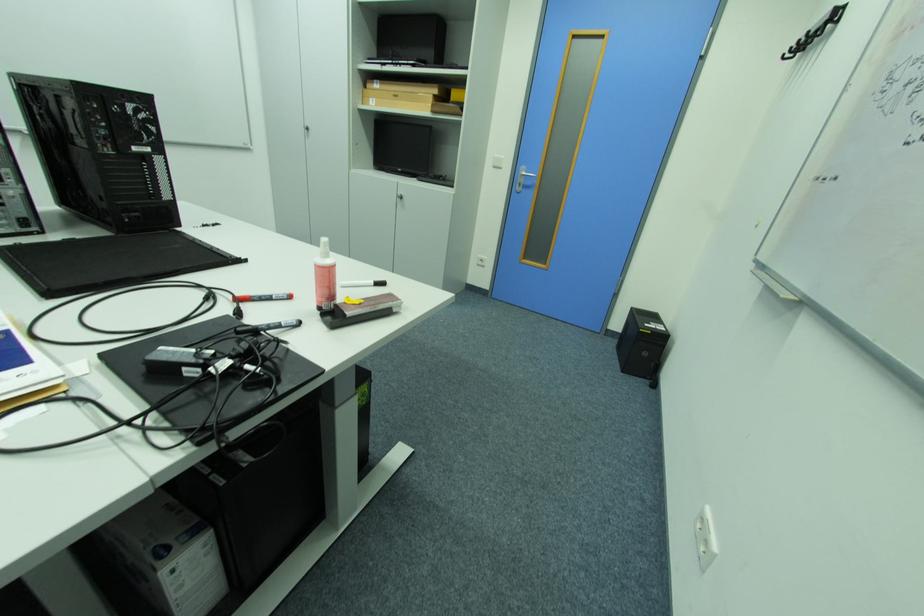
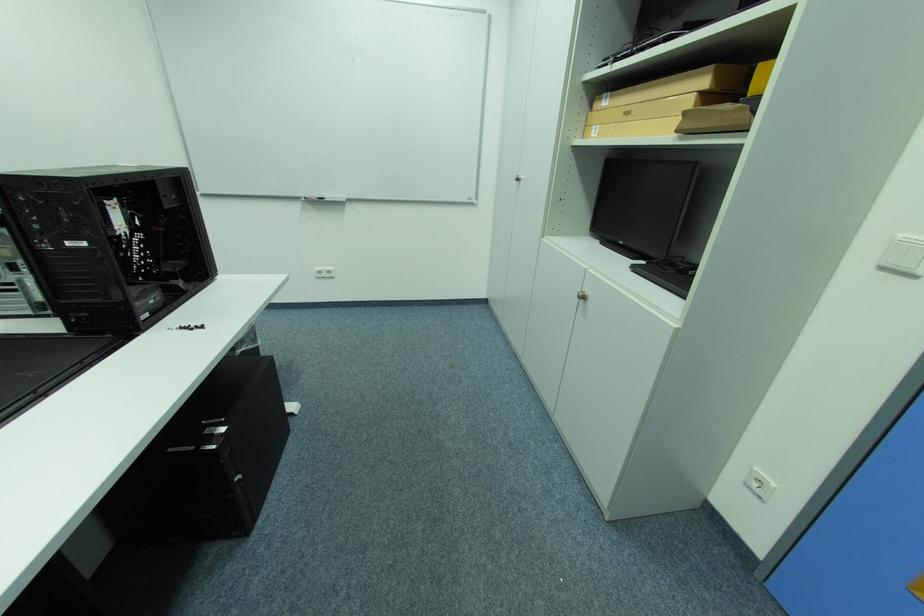
Where in the second image is the point corresponding to (504,156) from the first image?

(907, 236)